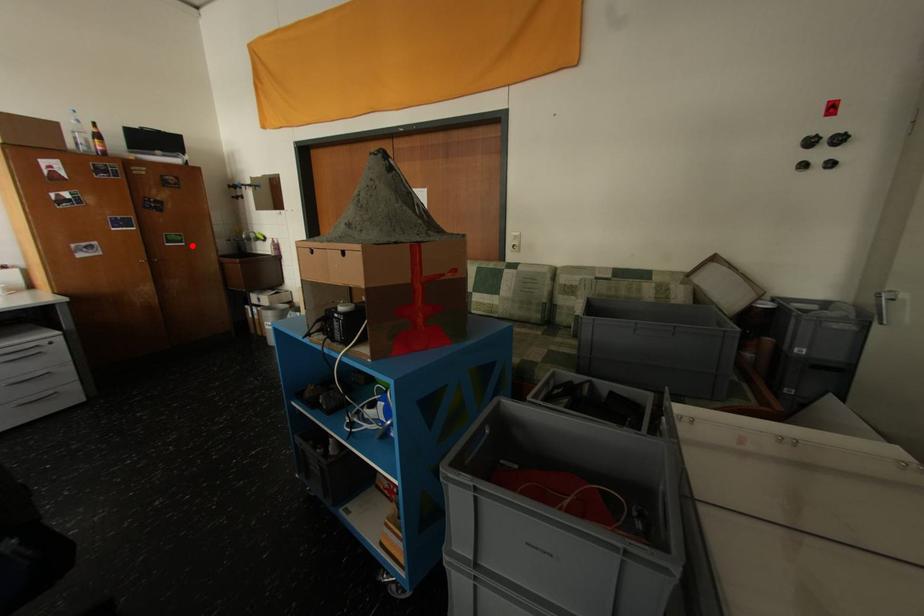
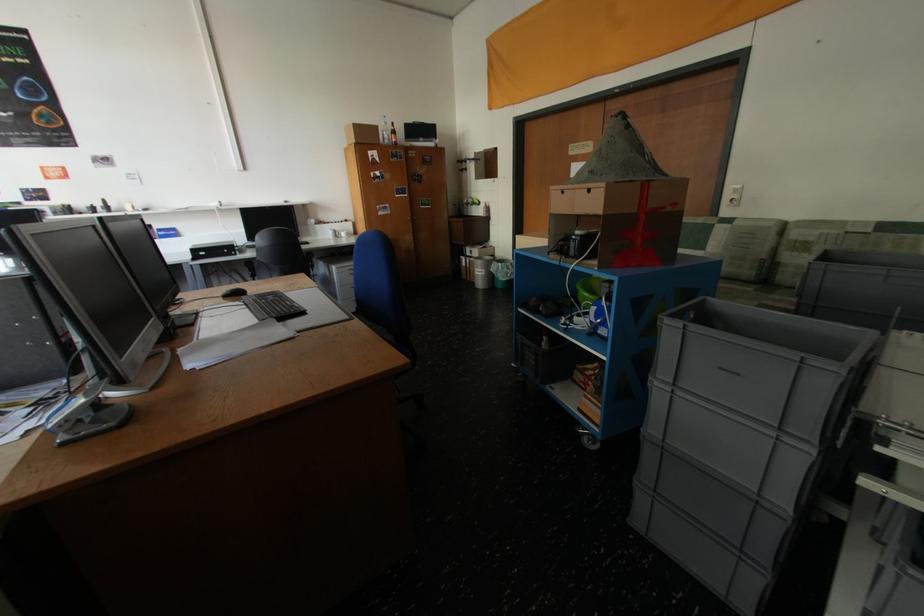
Question: A red point is marked in image1. In image2, is the corresponding 3D point closer to the camera or farther? Reply with the corresponding letter.

Choices:
 (A) The corresponding 3D point is closer.
 (B) The corresponding 3D point is farther.

Answer: (A)